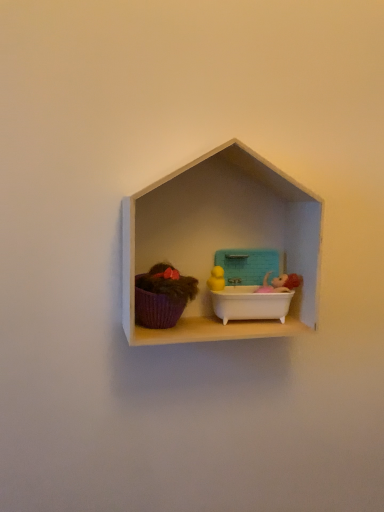
Question: Is white matte shelf at center surrounded by teal plastic lunch box at center?

Choices:
 (A) no
 (B) yes

Answer: (A)

Question: Is teal plastic lunch box at center smaller than white matte shelf at center?

Choices:
 (A) no
 (B) yes

Answer: (B)

Question: Is teal plastic lunch box at center in front of white matte shelf at center?

Choices:
 (A) yes
 (B) no

Answer: (B)

Question: Considering the relative sizes of teal plastic lunch box at center and white matte shelf at center in the image provided, is teal plastic lunch box at center shorter than white matte shelf at center?

Choices:
 (A) no
 (B) yes

Answer: (B)

Question: Is teal plastic lunch box at center to the right of white matte shelf at center from the viewer's perspective?

Choices:
 (A) no
 (B) yes

Answer: (B)

Question: In the image, is teal plastic lunch box at center on the left side or the right side of white matte shelf at center?

Choices:
 (A) left
 (B) right

Answer: (B)

Question: Is teal plastic lunch box at center taller or shorter than white matte shelf at center?

Choices:
 (A) tall
 (B) short

Answer: (B)

Question: In terms of size, does teal plastic lunch box at center appear bigger or smaller than white matte shelf at center?

Choices:
 (A) big
 (B) small

Answer: (B)

Question: From the image's perspective, is teal plastic lunch box at center positioned above or below white matte shelf at center?

Choices:
 (A) above
 (B) below

Answer: (B)

Question: Does point (177, 292) appear closer or farther from the camera than point (244, 237)?

Choices:
 (A) closer
 (B) farther

Answer: (A)

Question: Considering the positions of purple fabric basket at left and white matte shelf at center in the image, is purple fabric basket at left bigger or smaller than white matte shelf at center?

Choices:
 (A) big
 (B) small

Answer: (B)

Question: In the image, is purple fabric basket at left positioned in front of or behind white matte shelf at center?

Choices:
 (A) behind
 (B) front

Answer: (A)

Question: In terms of height, does purple fabric basket at left look taller or shorter compared to white matte shelf at center?

Choices:
 (A) short
 (B) tall

Answer: (A)

Question: Would you say white matte shelf at center is to the left or to the right of teal plastic lunch box at center in the picture?

Choices:
 (A) right
 (B) left

Answer: (B)

Question: Is point coord(183,188) closer or farther from the camera than point coord(233,262)?

Choices:
 (A) farther
 (B) closer

Answer: (B)